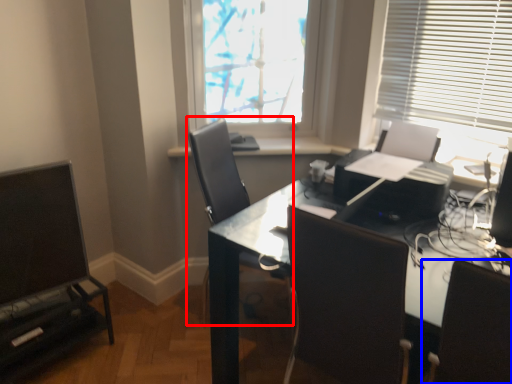
Question: Which of the following is the farthest to the observer, chair (highlighted by a red box) or chair (highlighted by a blue box)?

Choices:
 (A) chair
 (B) chair

Answer: (A)